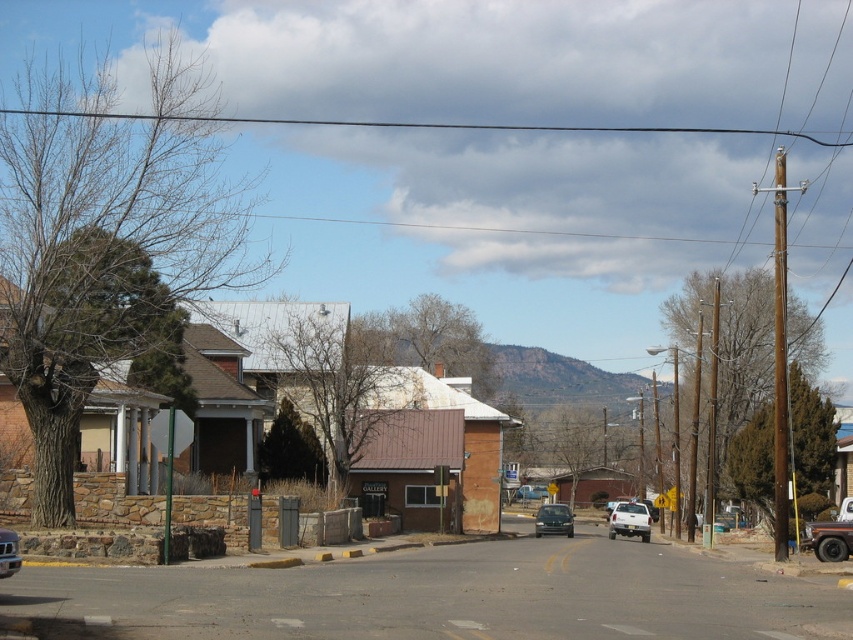
Question: Which of the following is the farthest from the observer?

Choices:
 (A) (616, 534)
 (B) (6, 554)

Answer: (A)

Question: Which object is farther from the camera taking this photo?

Choices:
 (A) satin black sedan at center
 (B) brown stone building at center

Answer: (A)

Question: Estimate the real-world distances between objects in this image. Which object is closer to the white matte truck at center?

Choices:
 (A) brushed metal truck at lower right
 (B) brown stone building at center
 (C) metallic silver car at center
 (D) satin black sedan at center

Answer: (D)

Question: Can you confirm if satin black sedan at center is wider than metallic silver car at center?

Choices:
 (A) no
 (B) yes

Answer: (B)

Question: Is white matte truck at center to the left of satin black sedan at center from the viewer's perspective?

Choices:
 (A) no
 (B) yes

Answer: (A)

Question: Is brown stone building at center wider than metallic silver car at center?

Choices:
 (A) yes
 (B) no

Answer: (A)